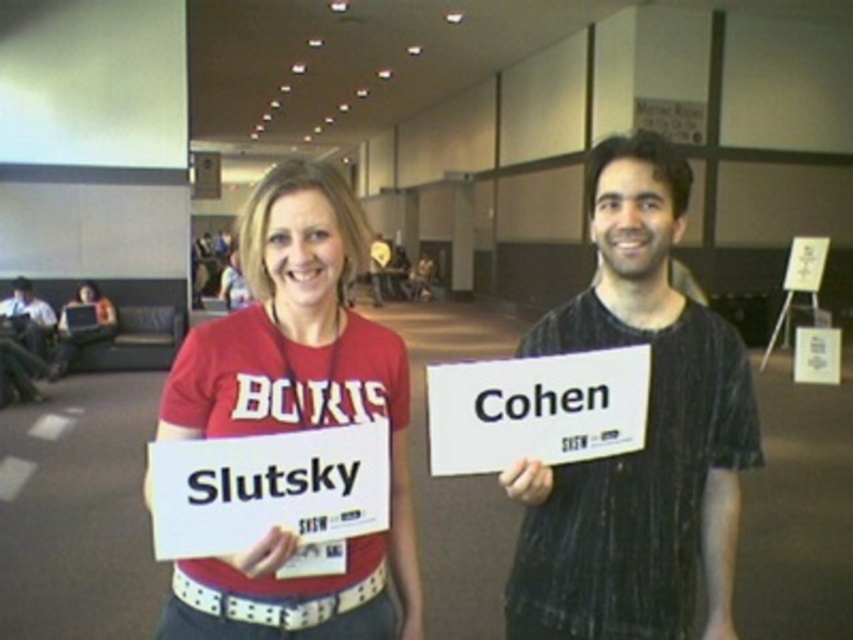
You are organizing a photo shoot and need to arrange two shirts for a display. The black textured shirt at center and the matte red shirt at center must be placed side by side. If the display area has limited space, which shirt should you place first to ensure both fit properly?

The black textured shirt at center is smaller than the matte red shirt at center, so you should place the matte red shirt at center first to accommodate its larger size, ensuring both shirts fit within the display area.